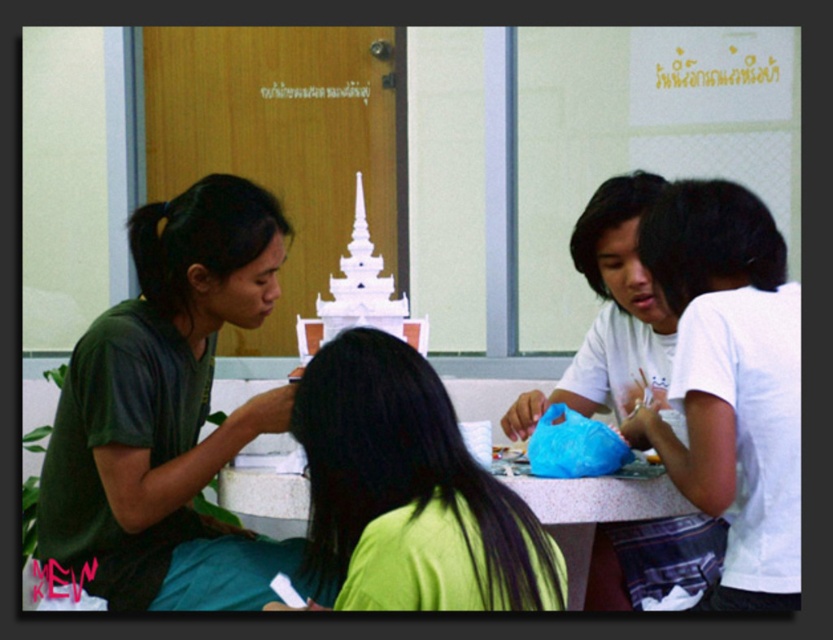
You are standing in the room and want to move from the point at coordinates point (692, 410) to the door. Which direction should you move relative to the point at coordinates point (687, 506)?

Since point (692, 410) is in front of point (687, 506), you should move towards the door in the direction away from point (687, 506).